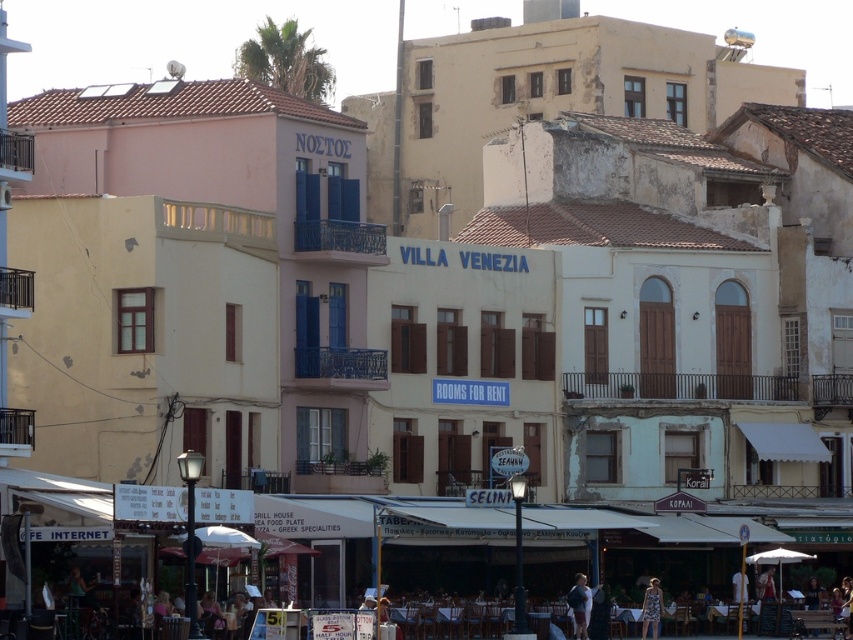
Question: Is light blue fabric dress at lower center bigger than printed fabric dress at lower right?

Choices:
 (A) yes
 (B) no

Answer: (B)

Question: Which object appears farthest from the camera in this image?

Choices:
 (A) light blue fabric dress at lower center
 (B) printed fabric dress at lower right

Answer: (A)

Question: Can you confirm if light blue fabric dress at lower center is positioned above printed fabric dress at lower right?

Choices:
 (A) yes
 (B) no

Answer: (A)

Question: Which point is closer to the camera?

Choices:
 (A) printed fabric dress at lower right
 (B) light blue fabric dress at lower center

Answer: (A)

Question: Can you confirm if light blue fabric dress at lower center is positioned below printed fabric dress at lower right?

Choices:
 (A) no
 (B) yes

Answer: (A)

Question: Among these objects, which one is farthest from the camera?

Choices:
 (A) light blue fabric dress at lower center
 (B) printed fabric dress at lower right

Answer: (A)